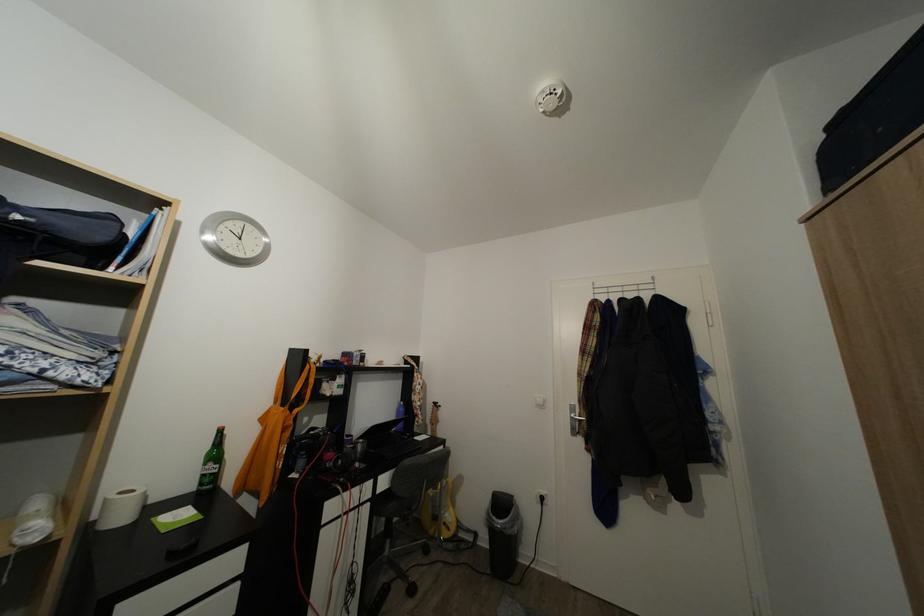
Where would you lift the white toilet paper roll? Please return your answer as a coordinate pair (x, y).

(120, 507)